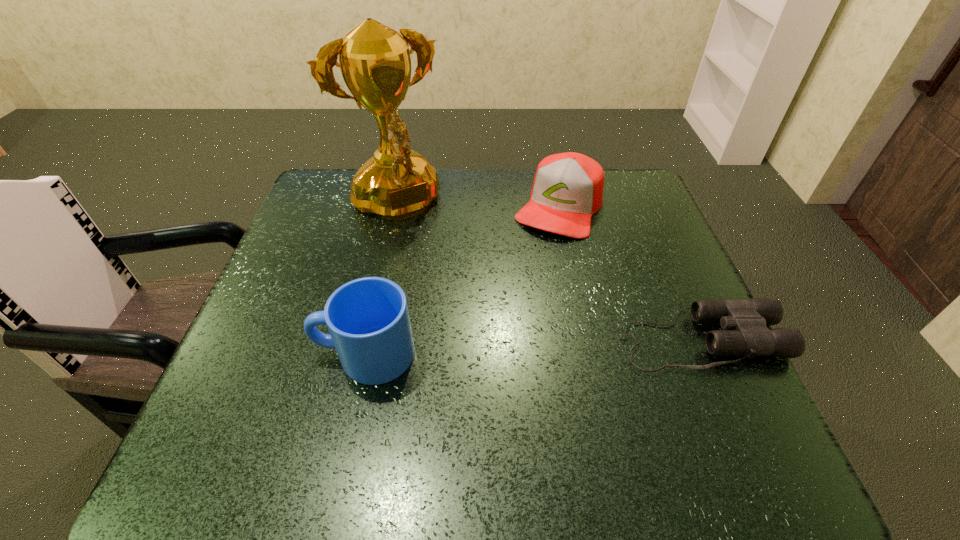
Find the location of a particular element. This screenshot has height=540, width=960. mug is located at coordinates (368, 320).

You are a GUI agent. You are given a task and a screenshot of the screen. Output one action in this format:
    pyautogui.click(x=<x>, y=<y>)
    Task: Click on the binoculars
    
    Given the screenshot: What is the action you would take?
    pyautogui.click(x=745, y=322)

This screenshot has width=960, height=540. In order to click on baseball cap in this screenshot , I will do `click(567, 190)`.

The image size is (960, 540). I want to click on award, so click(398, 183).

You are a GUI agent. You are given a task and a screenshot of the screen. Output one action in this format:
    pyautogui.click(x=<x>, y=<y>)
    Task: Click on the vacant area situated on the side of the mug with the handle
    Image resolution: width=960 pixels, height=540 pixels.
    Given the screenshot: What is the action you would take?
    pyautogui.click(x=273, y=354)

At what (x,y) coordinates should I click in order to perform the action: click on vacant space located 0.070m on the side of the mug with the handle. Please return your answer as a coordinate pair (x, y). Looking at the image, I should click on coord(278,354).

At what (x,y) coordinates should I click in order to perform the action: click on free location located 0.070m on the front-facing side of the baseball cap. Please return your answer as a coordinate pair (x, y). This screenshot has height=540, width=960. Looking at the image, I should click on (537, 255).

At what (x,y) coordinates should I click in order to perform the action: click on blank space located 0.350m on the front-facing side of the baseball cap. Please return your answer as a coordinate pair (x, y). The width and height of the screenshot is (960, 540). Looking at the image, I should click on (491, 345).

Image resolution: width=960 pixels, height=540 pixels. I want to click on free location located on the front-facing side of the baseball cap, so click(527, 275).

At what (x,y) coordinates should I click in order to perform the action: click on vacant point located on the front side of the award. Please return your answer as a coordinate pair (x, y). The height and width of the screenshot is (540, 960). Looking at the image, I should click on (457, 306).